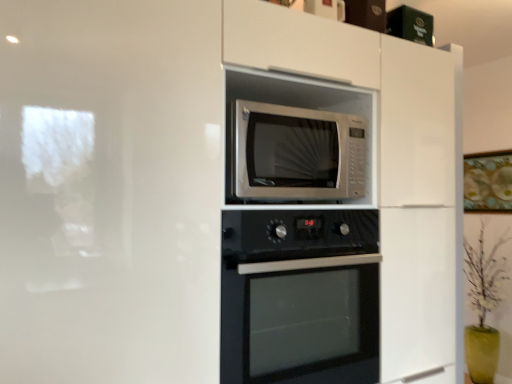
This screenshot has width=512, height=384. Describe the element at coordinates (300, 296) in the screenshot. I see `black glass oven at center` at that location.

Locate an element on the screen. This screenshot has width=512, height=384. white glossy microwave at upper center is located at coordinates (388, 162).

Is silver metallic microwave at center far from white glossy microwave at upper center?

No, there isn't a large distance between silver metallic microwave at center and white glossy microwave at upper center.

From a real-world perspective, is silver metallic microwave at center under white glossy microwave at upper center?

No.

Can you confirm if silver metallic microwave at center is smaller than white glossy microwave at upper center?

Yes, silver metallic microwave at center is smaller than white glossy microwave at upper center.

Is silver metallic microwave at center not inside white glossy microwave at upper center?

No, most part of silver metallic microwave at center lies within white glossy microwave at upper center.

In order to click on microwave oven located on the right of white glossy microwave at upper center in this screenshot , I will do `click(298, 153)`.

Would you say white glossy microwave at upper center is a long distance from silver metallic microwave at center?

No, there isn't a large distance between white glossy microwave at upper center and silver metallic microwave at center.

Considering the sizes of objects white glossy microwave at upper center and silver metallic microwave at center in the image provided, who is wider, white glossy microwave at upper center or silver metallic microwave at center?

With larger width is white glossy microwave at upper center.

Image resolution: width=512 pixels, height=384 pixels. In order to click on microwave oven behind the black glass oven at center in this screenshot , I will do `click(298, 153)`.

Is black glass oven at center at the back of silver metallic microwave at center?

silver metallic microwave at center is not turned away from black glass oven at center.

Considering the relative positions of silver metallic microwave at center and black glass oven at center in the image provided, is silver metallic microwave at center to the left or to the right of black glass oven at center?

From the image, it's evident that silver metallic microwave at center is to the left of black glass oven at center.

Is silver metallic microwave at center wider or thinner than black glass oven at center?

Considering their sizes, silver metallic microwave at center looks slimmer than black glass oven at center.

From the picture: How much distance is there between black glass oven at center and silver metallic microwave at center?

black glass oven at center is 28.92 centimeters away from silver metallic microwave at center.

Could silver metallic microwave at center be considered to be inside black glass oven at center?

That's incorrect, silver metallic microwave at center is not inside black glass oven at center.

Could you tell me if black glass oven at center is turned towards silver metallic microwave at center?

No, black glass oven at center is not oriented towards silver metallic microwave at center.

Is black glass oven at center wider or thinner than silver metallic microwave at center?

Considering their sizes, black glass oven at center looks broader than silver metallic microwave at center.

From a real-world perspective, is black glass oven at center beneath white glossy microwave at upper center?

Yes, from a real-world perspective, black glass oven at center is below white glossy microwave at upper center.

Does black glass oven at center contain white glossy microwave at upper center?

No, white glossy microwave at upper center is not inside black glass oven at center.

Which is behind, black glass oven at center or white glossy microwave at upper center?

black glass oven at center is further from the camera.

From a real-world perspective, is white glossy microwave at upper center located beneath black glass oven at center?

No, from a real-world perspective, white glossy microwave at upper center is not under black glass oven at center.

Does point (448, 349) come closer to viewer compared to point (314, 373)?

No, (448, 349) is further to viewer.

How much distance is there between white glossy microwave at upper center and black glass oven at center?

white glossy microwave at upper center and black glass oven at center are 33.56 centimeters apart.

In the image, there is a silver metallic microwave at center. Where is `dresser below it (from the image's perspective)`? This screenshot has width=512, height=384. dresser below it (from the image's perspective) is located at coordinates (388, 162).

At what (x,y) coordinates should I click in order to perform the action: click on microwave oven above the white glossy microwave at upper center (from the image's perspective). Please return your answer as a coordinate pair (x, y). This screenshot has height=384, width=512. Looking at the image, I should click on (298, 153).

Considering their positions, is silver metallic microwave at center positioned further to white glossy microwave at upper center than black glass oven at center?

black glass oven at center.

Considering their positions, is silver metallic microwave at center positioned closer to black glass oven at center than white glossy microwave at upper center?

Based on the image, silver metallic microwave at center appears to be nearer to black glass oven at center.

From the image, which object appears to be nearer to silver metallic microwave at center, white glossy microwave at upper center or black glass oven at center?

white glossy microwave at upper center.

From the image, which object appears to be farther from silver metallic microwave at center, black glass oven at center or white glossy microwave at upper center?

The object further to silver metallic microwave at center is black glass oven at center.

Which object lies further to the anchor point black glass oven at center, white glossy microwave at upper center or silver metallic microwave at center?

white glossy microwave at upper center is further to black glass oven at center.

In the scene shown: Which object lies nearer to the anchor point white glossy microwave at upper center, black glass oven at center or silver metallic microwave at center?

Among the two, silver metallic microwave at center is located nearer to white glossy microwave at upper center.

Where is `dresser between silver metallic microwave at center and black glass oven at center in the up-down direction`? This screenshot has height=384, width=512. dresser between silver metallic microwave at center and black glass oven at center in the up-down direction is located at coordinates (388, 162).